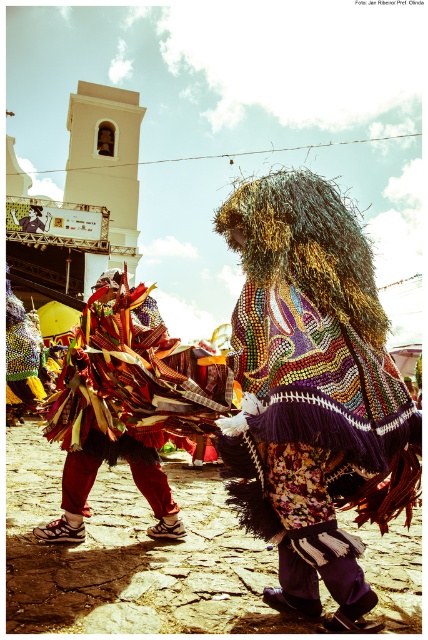
Is beaded fabric cape at center below bright red fabric at center?

No.

This screenshot has height=640, width=428. In order to click on beaded fabric cape at center in this screenshot , I will do `click(315, 442)`.

Identify the location of beaded fabric cape at center. This screenshot has height=640, width=428. (x=315, y=442).